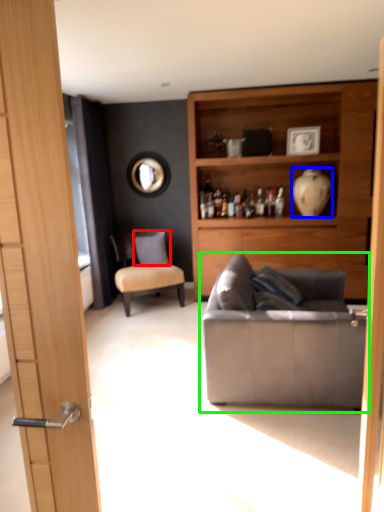
Question: Which object is the farthest from pillow (highlighted by a red box)? Choose among these: vase (highlighted by a blue box) or studio couch (highlighted by a green box).

Choices:
 (A) vase
 (B) studio couch

Answer: (B)